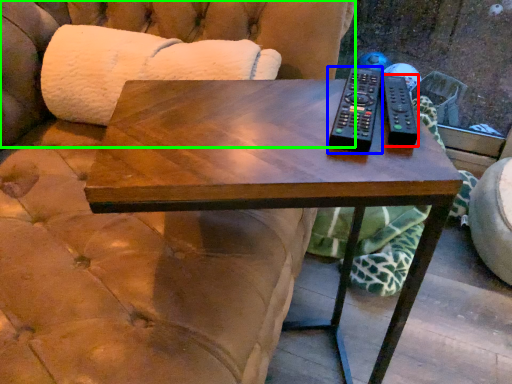
Question: Which object is positioned farthest from remote (highlighted by a red box)? Select from remote (highlighted by a blue box) and couch (highlighted by a green box).

Choices:
 (A) remote
 (B) couch

Answer: (B)